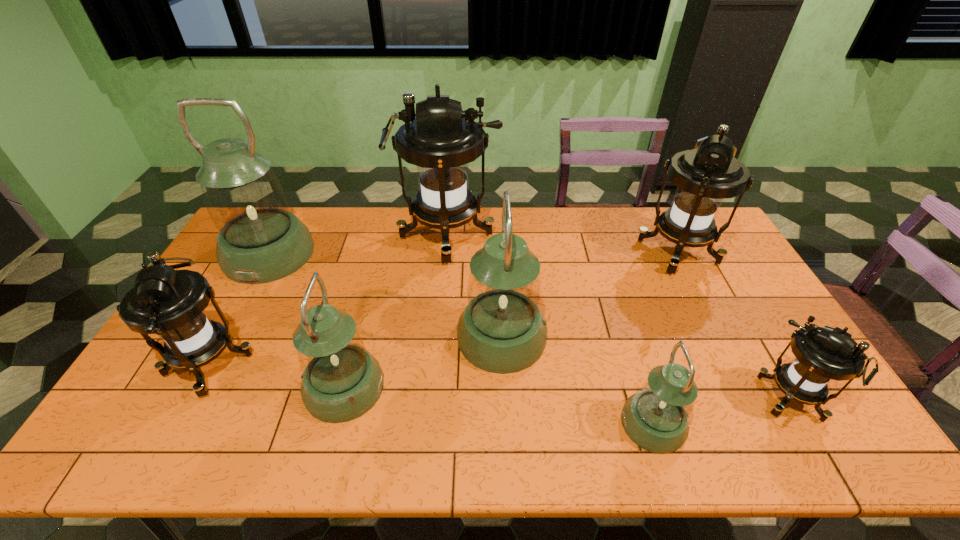
Locate an element on the screen. This screenshot has height=540, width=960. vacant space that's between the second biggest black lantern and the rightmost greenish lantern is located at coordinates (664, 338).

Identify the location of vacant area between the third smallest greenish lantern and the second smallest greenish lantern. (422, 362).

Select which object appears as the second closest to the biggest greenish lantern. Please provide its 2D coordinates. Your answer should be formatted as a tuple, i.e. [(x, y)], where the tuple contains the x and y coordinates of a point satisfying the conditions above.

[(442, 139)]

Find the location of a particular element. This screenshot has width=960, height=540. the seventh closest object to the third black lantern from right to left is located at coordinates (822, 354).

Identify which lantern is the third closest to the smallest black lantern. Please provide its 2D coordinates. Your answer should be formatted as a tuple, i.e. [(x, y)], where the tuple contains the x and y coordinates of a point satisfying the conditions above.

[(502, 330)]

Identify which lantern is located as the third nearest to the leftmost greenish lantern. Please provide its 2D coordinates. Your answer should be formatted as a tuple, i.e. [(x, y)], where the tuple contains the x and y coordinates of a point satisfying the conditions above.

[(341, 381)]

Identify which greenish lantern is located as the fourth nearest to the leftmost black lantern. Please provide its 2D coordinates. Your answer should be formatted as a tuple, i.e. [(x, y)], where the tuple contains the x and y coordinates of a point satisfying the conditions above.

[(656, 418)]

Where is `greenish lantern that is the fourth closest to the leftmost black lantern`? The width and height of the screenshot is (960, 540). greenish lantern that is the fourth closest to the leftmost black lantern is located at coordinates (656, 418).

Locate which black lantern ranks in proximity to the leftmost greenish lantern. Please provide its 2D coordinates. Your answer should be formatted as a tuple, i.e. [(x, y)], where the tuple contains the x and y coordinates of a point satisfying the conditions above.

[(170, 303)]

This screenshot has height=540, width=960. What are the coordinates of `black lantern that can be found as the second closest to the second biggest black lantern` in the screenshot? It's located at (442, 139).